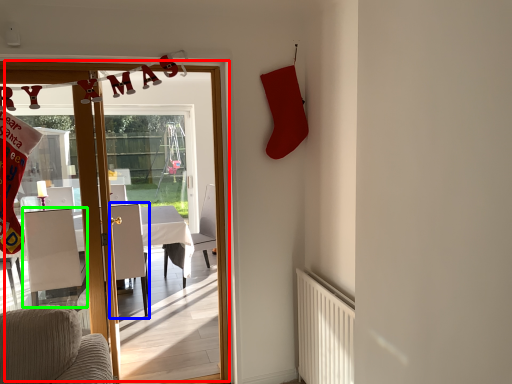
Question: Which is farther away from door (highlighted by a red box)? armchair (highlighted by a blue box) or armchair (highlighted by a green box)?

Choices:
 (A) armchair
 (B) armchair

Answer: (B)